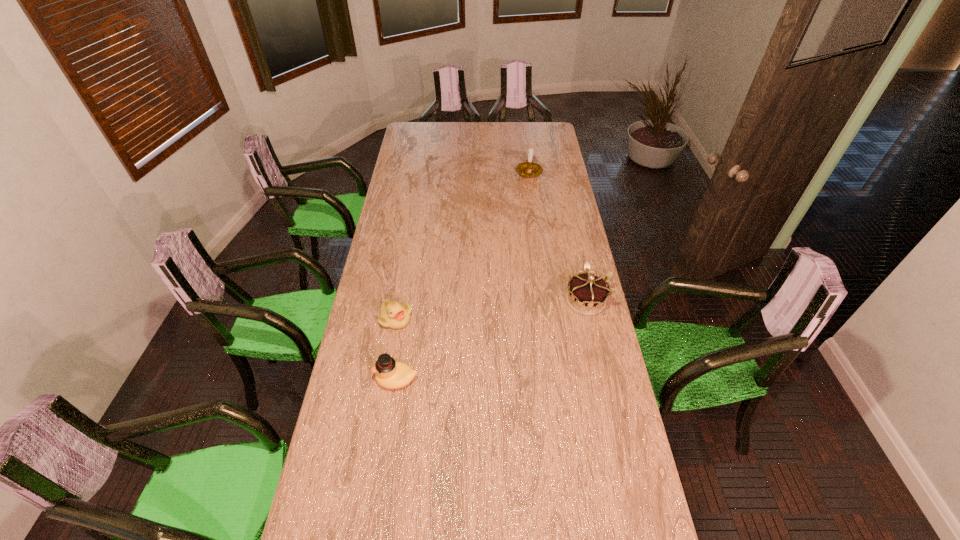
At what (x,y) coordinates should I click in order to perform the action: click on duck. Please return your answer as a coordinate pair (x, y). The width and height of the screenshot is (960, 540). Looking at the image, I should click on (389, 373).

What are the coordinates of `crown` in the screenshot? It's located at [x=587, y=294].

Image resolution: width=960 pixels, height=540 pixels. I want to click on duckling, so click(394, 315).

The width and height of the screenshot is (960, 540). In order to click on candle holder in this screenshot , I will do `click(526, 169)`.

Where is `the tallest object`? the tallest object is located at coordinates (526, 169).

The width and height of the screenshot is (960, 540). I want to click on free point located on the front-facing side of the duck, so click(x=360, y=379).

Find the location of a particular element. This screenshot has height=540, width=960. vacant space located on the back of the crown is located at coordinates (574, 250).

The image size is (960, 540). In order to click on blank space located on the front-facing side of the shortest object in this screenshot , I will do `click(476, 351)`.

What are the coordinates of `free space located 0.400m on the front-facing side of the shortest object` in the screenshot? It's located at (506, 363).

Locate an element on the screen. vacant space situated on the front-facing side of the shortest object is located at coordinates (486, 355).